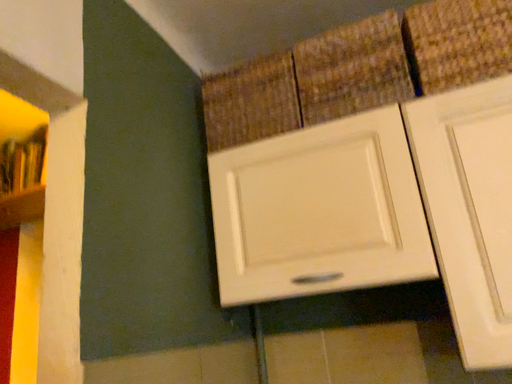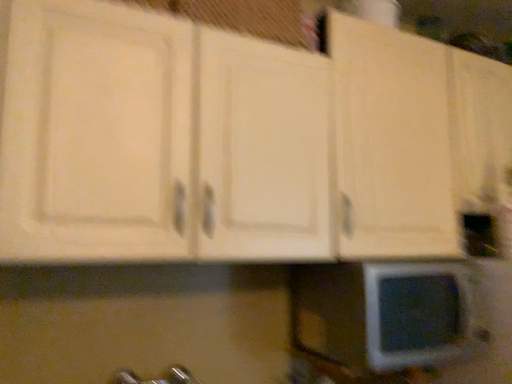
Question: How did the camera likely rotate when shooting the video?

Choices:
 (A) rotated downward
 (B) rotated upward

Answer: (A)